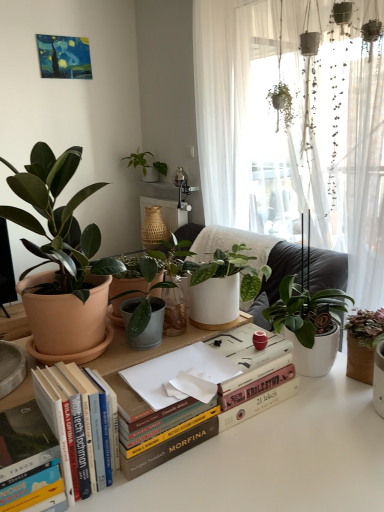
In order to face green matte plant at upper center, the first houseplant viewed from the top, should I rotate leftwards or rightwards?

A 6.681 degree turn to the left will do.

What do you see at coordinates (176, 371) in the screenshot? I see `white paper at center, which is counted as the second paperback book, starting from the bottom` at bounding box center [176, 371].

What do you see at coordinates (28, 460) in the screenshot? The height and width of the screenshot is (512, 384). I see `hardcover book at lower left, the 1th paperback book from the bottom` at bounding box center [28, 460].

You are a GUI agent. You are given a task and a screenshot of the screen. Output one action in this format:
    pyautogui.click(x=<x>, y=<y>)
    Task: Click on the green matte plant at upper center, which is counted as the first houseplant, starting from the back
    
    Given the screenshot: What is the action you would take?
    pyautogui.click(x=147, y=165)

Is hardcover books at center thinner than green matte plant at right, positioned as the 1th houseplant in right-to-left order?

Correct, the width of hardcover books at center is less than that of green matte plant at right, positioned as the 1th houseplant in right-to-left order.

How much distance is there between hardcover books at center and green matte plant at right, the 3th houseplant from the left?

hardcover books at center is 25.03 inches away from green matte plant at right, the 3th houseplant from the left.

From a real-world perspective, is hardcover books at center physically above green matte plant at right, placed as the 2th houseplant when sorted from front to back?

No, from a real-world perspective, hardcover books at center is not over green matte plant at right, placed as the 2th houseplant when sorted from front to back

Looking at the image, does hardcover books at center seem bigger or smaller compared to green matte plant at right, the third houseplant from the top?

Considering their sizes, hardcover books at center takes up less space than green matte plant at right, the third houseplant from the top.

Considering the relative sizes of matte terracotta pot at left, marked as the 2th houseplant in a left-to-right arrangement, and hardcover books at center in the image provided, is matte terracotta pot at left, marked as the 2th houseplant in a left-to-right arrangement, thinner than hardcover books at center?

In fact, matte terracotta pot at left, marked as the 2th houseplant in a left-to-right arrangement, might be wider than hardcover books at center.

Does matte terracotta pot at left, which is the 2th houseplant in bottom-to-top order, contain hardcover books at center?

Definitely not — hardcover books at center is not inside matte terracotta pot at left, which is the 2th houseplant in bottom-to-top order.

Does matte terracotta pot at left, which is the 2th houseplant in bottom-to-top order, lie in front of hardcover books at center?

Yes, matte terracotta pot at left, which is the 2th houseplant in bottom-to-top order, is closer to the viewer.

Can you see matte terracotta pot at left, which is counted as the 2th houseplant, starting from the top, touching hardcover books at center?

matte terracotta pot at left, which is counted as the 2th houseplant, starting from the top, and hardcover books at center are not in contact.

Does hardcover books at center have a smaller size compared to white paper at center, which is counted as the second paperback book, starting from the bottom?

Actually, hardcover books at center might be larger than white paper at center, which is counted as the second paperback book, starting from the bottom.

Is hardcover books at center inside the boundaries of white paper at center, the 2th paperback book viewed from the left, or outside?

hardcover books at center is not enclosed by white paper at center, the 2th paperback book viewed from the left.

Is hardcover books at center facing away from white paper at center, which is counted as the second paperback book, starting from the bottom?

hardcover books at center does not have its back to white paper at center, which is counted as the second paperback book, starting from the bottom.

Does hardcover books at center have a greater height compared to white paper at center, which is counted as the second paperback book, starting from the bottom?

Yes, hardcover books at center is taller than white paper at center, which is counted as the second paperback book, starting from the bottom.

From a real-world perspective, is matte terracotta pot at left, the second houseplant when ordered from right to left, below green matte plant at upper center, which ranks as the third houseplant in front-to-back order?

Yes, from a real-world perspective, matte terracotta pot at left, the second houseplant when ordered from right to left, is below green matte plant at upper center, which ranks as the third houseplant in front-to-back order.

What's the angular difference between matte terracotta pot at left, which is the 1th houseplant in front-to-back order, and green matte plant at upper center, the first houseplant viewed from the top,'s facing directions?

The angle between the facing direction of matte terracotta pot at left, which is the 1th houseplant in front-to-back order, and the facing direction of green matte plant at upper center, the first houseplant viewed from the top, is 90.1 degrees.

From the image's perspective, relative to green matte plant at upper center, marked as the 3th houseplant in a bottom-to-top arrangement, is matte terracotta pot at left, which is the 1th houseplant in front-to-back order, above or below?

matte terracotta pot at left, which is the 1th houseplant in front-to-back order, is below green matte plant at upper center, marked as the 3th houseplant in a bottom-to-top arrangement.

Is matte terracotta pot at left, which is counted as the 2th houseplant, starting from the top, in front of green matte plant at upper center, marked as the 3th houseplant in a bottom-to-top arrangement?

Yes, matte terracotta pot at left, which is counted as the 2th houseplant, starting from the top, is in front of green matte plant at upper center, marked as the 3th houseplant in a bottom-to-top arrangement.

Is green matte plant at upper center, marked as the first houseplant in a left-to-right arrangement, facing away from green matte plant at right, the third houseplant from the top?

No, green matte plant at right, the third houseplant from the top, is not at the back of green matte plant at upper center, marked as the first houseplant in a left-to-right arrangement.

In terms of width, does green matte plant at upper center, which ranks as the third houseplant in front-to-back order, look wider or thinner when compared to green matte plant at right, placed as the 1th houseplant when sorted from bottom to top?

Clearly, green matte plant at upper center, which ranks as the third houseplant in front-to-back order, has more width compared to green matte plant at right, placed as the 1th houseplant when sorted from bottom to top.

From the picture: Can you confirm if green matte plant at upper center, marked as the first houseplant in a left-to-right arrangement, is smaller than green matte plant at right, the 3th houseplant from the left?

No.

Do you think green matte plant at right, positioned as the 1th houseplant in right-to-left order, is within green matte plant at upper center, marked as the 3th houseplant in a bottom-to-top arrangement, or outside of it?

green matte plant at right, positioned as the 1th houseplant in right-to-left order, is outside green matte plant at upper center, marked as the 3th houseplant in a bottom-to-top arrangement.

Which is more to the left, green matte plant at right, the third houseplant from the top, or green matte plant at upper center, marked as the first houseplant in a left-to-right arrangement?

Positioned to the left is green matte plant at upper center, marked as the first houseplant in a left-to-right arrangement.

Considering the positions of objects green matte plant at right, placed as the 1th houseplant when sorted from bottom to top, and green matte plant at upper center, which ranks as the third houseplant in front-to-back order, in the image provided, who is behind, green matte plant at right, placed as the 1th houseplant when sorted from bottom to top, or green matte plant at upper center, which ranks as the third houseplant in front-to-back order,?

green matte plant at upper center, which ranks as the third houseplant in front-to-back order, is behind.

Considering the relative sizes of green matte plant at right, placed as the 1th houseplant when sorted from bottom to top, and green matte plant at upper center, which is counted as the first houseplant, starting from the back, in the image provided, is green matte plant at right, placed as the 1th houseplant when sorted from bottom to top, bigger than green matte plant at upper center, which is counted as the first houseplant, starting from the back,?

Incorrect, green matte plant at right, placed as the 1th houseplant when sorted from bottom to top, is not larger than green matte plant at upper center, which is counted as the first houseplant, starting from the back.

Which of these two, matte terracotta pot at left, which is counted as the 2th houseplant, starting from the top, or white paper at center, marked as the 1th paperback book in a top-to-bottom arrangement, is smaller?

With smaller size is white paper at center, marked as the 1th paperback book in a top-to-bottom arrangement.

From a real-world perspective, is matte terracotta pot at left, which is the 2th houseplant in bottom-to-top order, physically above white paper at center, the 2th paperback book viewed from the left?

Indeed, from a real-world perspective, matte terracotta pot at left, which is the 2th houseplant in bottom-to-top order, stands above white paper at center, the 2th paperback book viewed from the left.

Is matte terracotta pot at left, which is counted as the 2th houseplant, starting from the top, directly adjacent to white paper at center, the 2th paperback book viewed from the left?

No, matte terracotta pot at left, which is counted as the 2th houseplant, starting from the top, is not touching white paper at center, the 2th paperback book viewed from the left.

Between matte terracotta pot at left, which is counted as the 2th houseplant, starting from the top, and white paper at center, which is counted as the second paperback book, starting from the bottom, which one appears on the right side from the viewer's perspective?

white paper at center, which is counted as the second paperback book, starting from the bottom, is more to the right.

Identify the location of houseplant that appears on the right of hardcover books at center. The width and height of the screenshot is (384, 512). (363, 343).

Image resolution: width=384 pixels, height=512 pixels. I want to click on book located below the matte terracotta pot at left, the third houseplant when ordered from back to front (from the image's perspective), so click(87, 421).

Based on their spatial positions, is hardcover books at center or green matte plant at right, the 3th houseplant from the left, closer to white paper at center, which appears as the 1th paperback book when viewed from the right?

hardcover books at center lies closer to white paper at center, which appears as the 1th paperback book when viewed from the right, than the other object.

From the image, which object appears to be nearer to green matte plant at right, placed as the 2th houseplant when sorted from front to back, hardcover books at center or green matte plant at upper center, marked as the 3th houseplant in a bottom-to-top arrangement?

hardcover books at center lies closer to green matte plant at right, placed as the 2th houseplant when sorted from front to back, than the other object.

Which object lies nearer to the anchor point hardcover books at center, matte terracotta pot at left, the third houseplant when ordered from back to front, or green matte plant at upper center, marked as the 3th houseplant in a bottom-to-top arrangement?

The object closer to hardcover books at center is matte terracotta pot at left, the third houseplant when ordered from back to front.

Estimate the real-world distances between objects in this image. Which object is further from matte terracotta pot at left, which is the 2th houseplant in bottom-to-top order, green matte plant at upper center, which is counted as the first houseplant, starting from the back, or hardcover books at center?

green matte plant at upper center, which is counted as the first houseplant, starting from the back, lies further to matte terracotta pot at left, which is the 2th houseplant in bottom-to-top order, than the other object.

When comparing their distances from white paper at center, which appears as the 1th paperback book when viewed from the right, does green matte plant at upper center, which is counted as the first houseplant, starting from the back, or green matte plant at right, positioned as the 1th houseplant in right-to-left order, seem further?

green matte plant at upper center, which is counted as the first houseplant, starting from the back, lies further to white paper at center, which appears as the 1th paperback book when viewed from the right, than the other object.

When comparing their distances from green matte plant at upper center, which ranks as the third houseplant in front-to-back order, does hardcover books at center or green matte plant at right, placed as the 1th houseplant when sorted from bottom to top, seem further?

The object further to green matte plant at upper center, which ranks as the third houseplant in front-to-back order, is hardcover books at center.

From the image, which object appears to be farther from hardcover books at center, hardcover book at lower left, acting as the 2th paperback book starting from the right, or green matte plant at right, placed as the 1th houseplant when sorted from bottom to top?

green matte plant at right, placed as the 1th houseplant when sorted from bottom to top, is further to hardcover books at center.

When comparing their distances from green matte plant at upper center, which is counted as the first houseplant, starting from the back, does hardcover books at center or hardcover book at lower left, which is the 1th paperback book in left-to-right order, seem further?

hardcover book at lower left, which is the 1th paperback book in left-to-right order, is further to green matte plant at upper center, which is counted as the first houseplant, starting from the back.

At what (x,y) coordinates should I click in order to perform the action: click on houseplant between hardcover book at lower left, the second paperback book viewed from the top, and green matte plant at right, the 3th houseplant from the left, from left to right. Please return your answer as a coordinate pair (x, y). Looking at the image, I should click on (60, 256).

Find the location of a particular element. This screenshot has width=384, height=512. houseplant between matte terracotta pot at left, which is counted as the 2th houseplant, starting from the top, and green matte plant at upper center, the 3th houseplant viewed from the right, along the z-axis is located at coordinates (363, 343).

Identify the location of paperback book between hardcover books at center and green matte plant at right, the 3th houseplant from the left. (x=176, y=371).

Locate an element on the screen. paperback book between matte terracotta pot at left, marked as the 2th houseplant in a left-to-right arrangement, and green matte plant at upper center, the 3th houseplant viewed from the right, in the front-back direction is located at coordinates (176, 371).